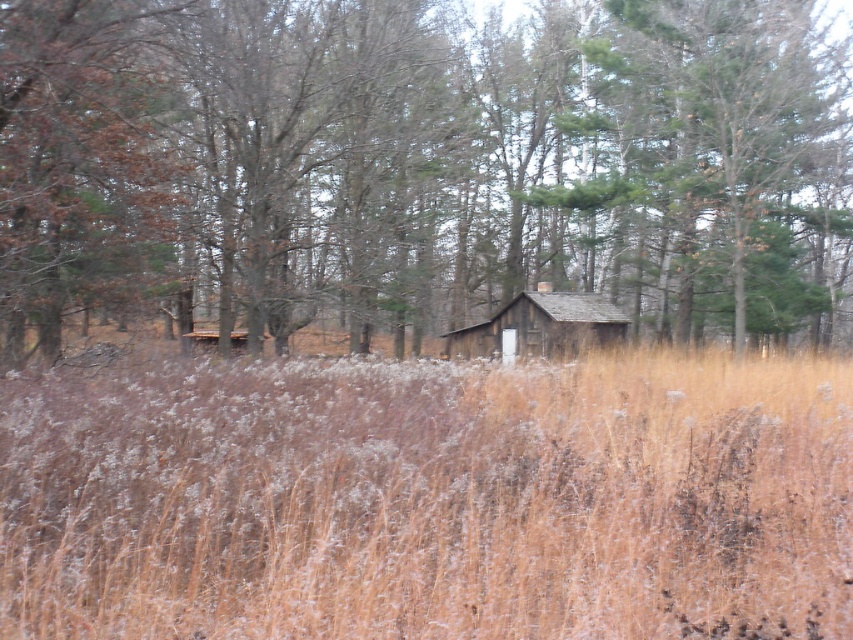
You are planning to build a small garden in the area between the brown dry grass at center and the wooden cabin at center. Based on the space available, which area would be more suitable for planting flowers that require a width of 3 meters?

The brown dry grass at center is wider than the wooden cabin at center, so it would be more suitable for planting flowers that require a width of 3 meters.

You are planning to build a small shed in the middle of the field. The shed requires a space that is wider than the brown dry grass at center. Is the brown wood tree at center a suitable location for the shed?

The brown wood tree at center might be wider than brown dry grass at center, so it could provide enough space for the shed. However, since the tree itself occupies space, you should consider removing it or choosing an area without obstacles.

You are standing in the field of tall dry grass and see the brown wood tree at center and the wooden cabin at center. Which object is positioned to the left?

The brown wood tree at center is to the left of the wooden cabin at center, so the brown wood tree at center is positioned to the left.